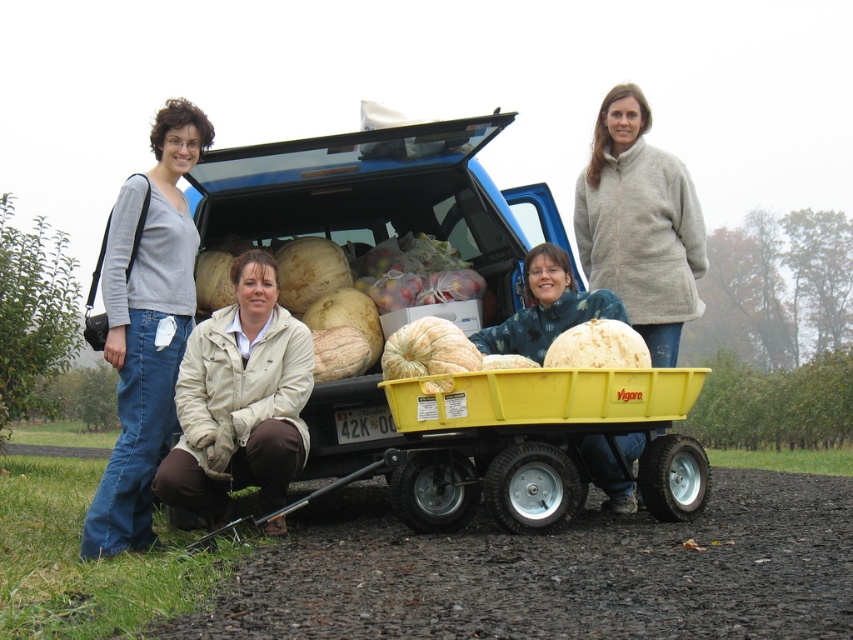
Is gray fleece jacket at center to the right of smooth white pumpkin at center from the viewer's perspective?

Yes, gray fleece jacket at center is to the right of smooth white pumpkin at center.

Based on the photo, is gray fleece jacket at center wider than smooth white pumpkin at center?

Yes, gray fleece jacket at center is wider than smooth white pumpkin at center.

Does point (683, 214) come behind point (621, 346)?

Yes, point (683, 214) is behind point (621, 346).

You are a GUI agent. You are given a task and a screenshot of the screen. Output one action in this format:
    pyautogui.click(x=<x>, y=<y>)
    Task: Click on the gray fleece jacket at center
    This screenshot has width=853, height=640.
    Given the screenshot: What is the action you would take?
    pyautogui.click(x=639, y=225)

Is matte gray sweater at left smaller than beige fabric jacket at lower center?

Incorrect, matte gray sweater at left is not smaller in size than beige fabric jacket at lower center.

The height and width of the screenshot is (640, 853). Describe the element at coordinates (146, 324) in the screenshot. I see `matte gray sweater at left` at that location.

Where is `matte gray sweater at left`? matte gray sweater at left is located at coordinates (146, 324).

Looking at this image, between matte gray sweater at left and gray fleece jacket at center, which one has less height?

With less height is gray fleece jacket at center.

Which is more to the right, matte gray sweater at left or gray fleece jacket at center?

gray fleece jacket at center

Is point (117, 467) positioned before point (672, 296)?

Yes, it is in front of point (672, 296).

Where is `matte gray sweater at left`? matte gray sweater at left is located at coordinates (146, 324).